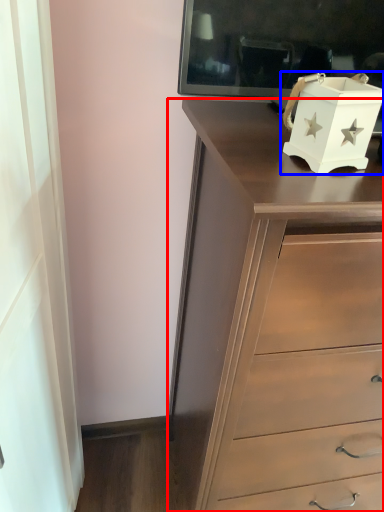
Question: Which object appears farthest to the camera in this image, chest of drawers (highlighted by a red box) or box (highlighted by a blue box)?

Choices:
 (A) chest of drawers
 (B) box

Answer: (B)